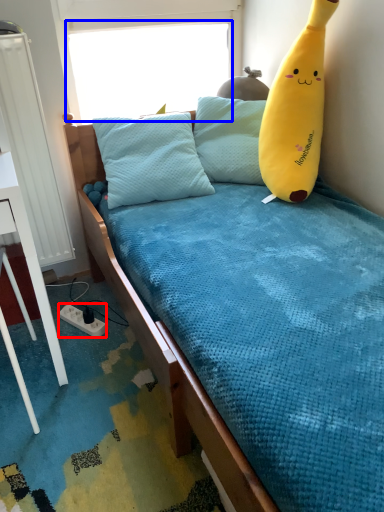
Question: Which object appears closest to the camera in this image, power outlet (highlighted by a red box) or window screen (highlighted by a blue box)?

Choices:
 (A) power outlet
 (B) window screen

Answer: (B)